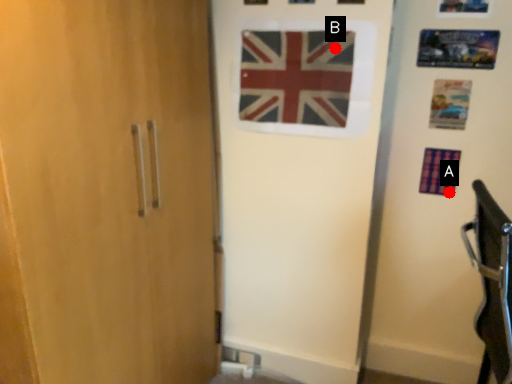
Question: Two points are circled on the image, labeled by A and B beside each circle. Which point is closer to the camera?

Choices:
 (A) A is closer
 (B) B is closer

Answer: (B)